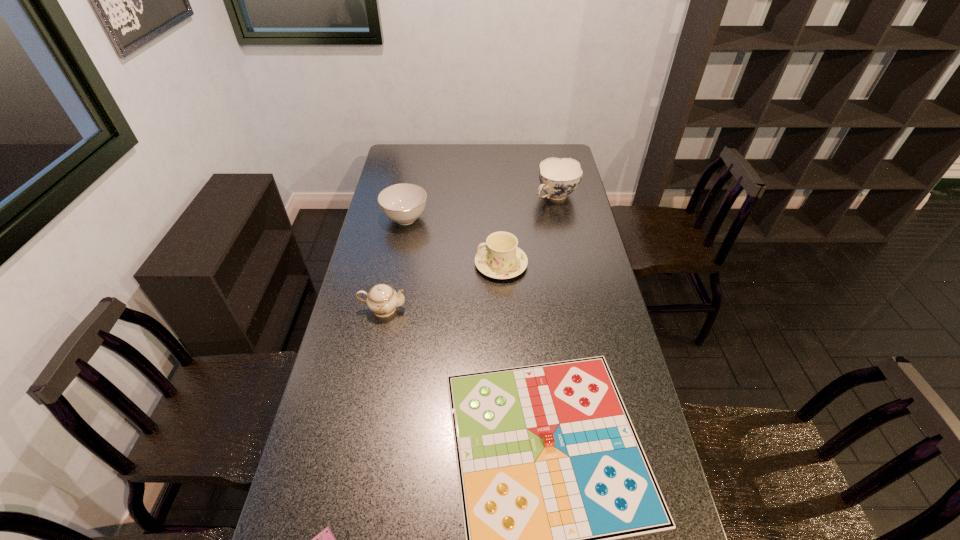
Locate an element on the screen. This screenshot has width=960, height=540. object located at the right edge is located at coordinates (559, 177).

I want to click on vacant space at the far edge of the desktop, so (x=472, y=150).

Image resolution: width=960 pixels, height=540 pixels. In the image, there is a desktop. Find the location of `free region at the left edge`. free region at the left edge is located at coordinates (399, 244).

What are the coordinates of `vacant position at the right edge of the desktop` in the screenshot? It's located at (565, 290).

The image size is (960, 540). What are the coordinates of `free space at the far left corner` in the screenshot? It's located at (398, 159).

This screenshot has width=960, height=540. I want to click on free point between the fourth farthest object and the tallest chinaware, so click(x=469, y=253).

This screenshot has width=960, height=540. What are the coordinates of `object that is the second closest one to the fourth farthest object` in the screenshot? It's located at (500, 258).

You are a GUI agent. You are given a task and a screenshot of the screen. Output one action in this format:
    pyautogui.click(x=<x>, y=<y>)
    Task: Click on the object that stands as the second closest to the gameboard
    
    Given the screenshot: What is the action you would take?
    pyautogui.click(x=382, y=299)

Identify the location of chinaware that stands as the fourth closest to the videotape. This screenshot has width=960, height=540. (559, 177).

Locate an element on the screen. The image size is (960, 540). chinaware object that ranks as the third closest to the rightmost chinaware is located at coordinates (382, 299).